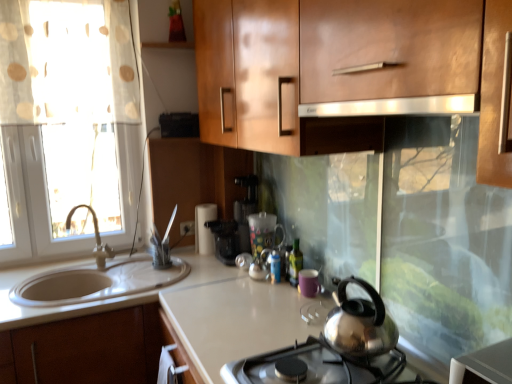
Locate an element on the screen. unoccupied area in front of green glass bottle at center is located at coordinates (293, 305).